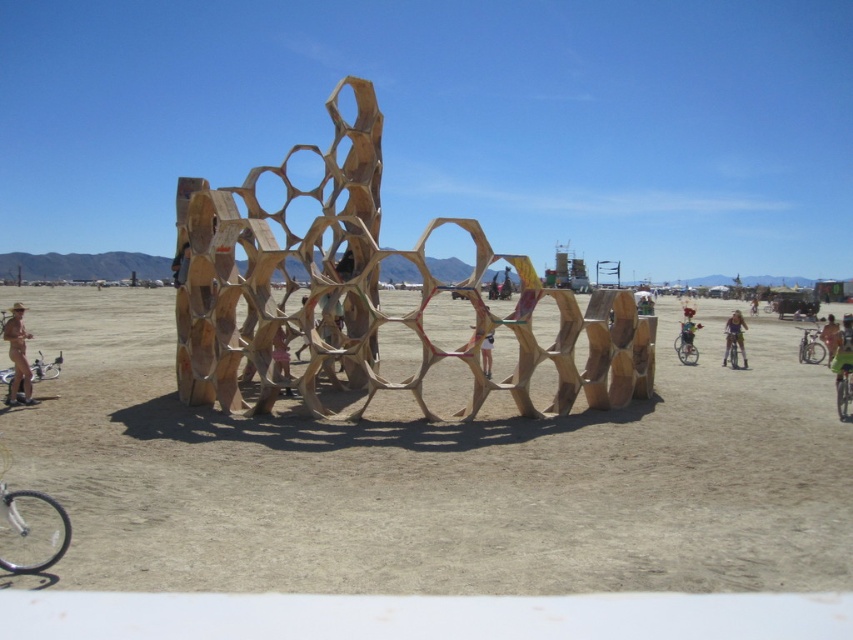
Is natural wood honeycomb structure at center smaller than metallic silver bicycle at center-right?

No.

Between natural wood honeycomb structure at center and metallic silver bicycle at center-right, which one appears on the left side from the viewer's perspective?

Positioned to the left is natural wood honeycomb structure at center.

What do you see at coordinates (366, 296) in the screenshot? This screenshot has height=640, width=853. I see `natural wood honeycomb structure at center` at bounding box center [366, 296].

The image size is (853, 640). In order to click on natural wood honeycomb structure at center in this screenshot , I will do click(x=366, y=296).

Does brown textured dirt at center have a lesser width compared to natural wood honeycomb structure at center?

No, brown textured dirt at center is not thinner than natural wood honeycomb structure at center.

Can you confirm if brown textured dirt at center is shorter than natural wood honeycomb structure at center?

Indeed, brown textured dirt at center has a lesser height compared to natural wood honeycomb structure at center.

Does point (567, 429) come in front of point (346, 196)?

That is True.

Locate an element on the screen. This screenshot has height=640, width=853. brown textured dirt at center is located at coordinates (434, 476).

Can you confirm if natural wood honeycomb structure at center is smaller than matte gold statue at lower left?

Actually, natural wood honeycomb structure at center might be larger than matte gold statue at lower left.

Can you confirm if natural wood honeycomb structure at center is bigger than matte gold statue at lower left?

Yes, natural wood honeycomb structure at center is bigger than matte gold statue at lower left.

Who is more forward, (560, 401) or (16, 374)?

Point (560, 401) is more forward.

Find the location of a particular element. natural wood honeycomb structure at center is located at coordinates (366, 296).